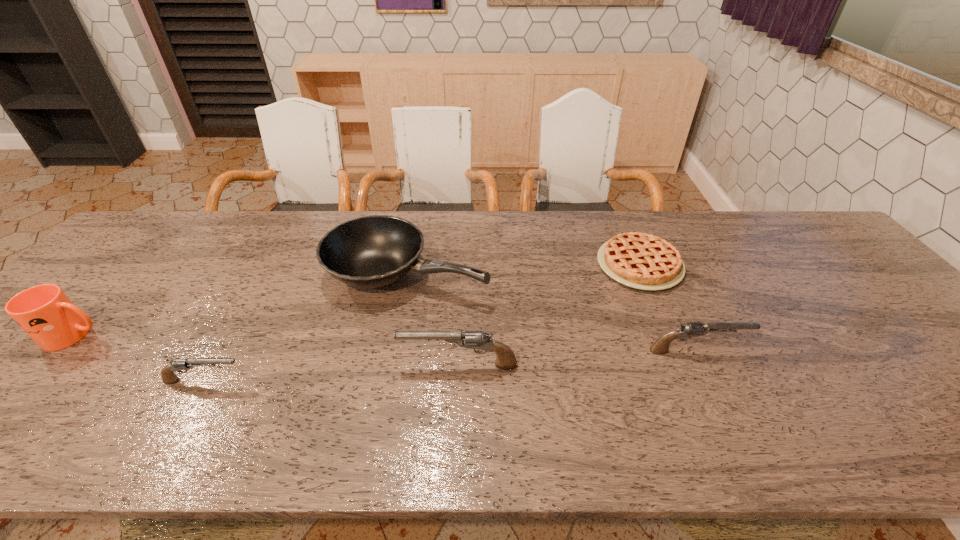
Where is `vacant region located 0.260m aiming along the barrel of the second farthest gun`? vacant region located 0.260m aiming along the barrel of the second farthest gun is located at coordinates (287, 365).

The width and height of the screenshot is (960, 540). I want to click on blank space located aiming along the barrel of the second farthest gun, so tap(265, 365).

Where is `vacant area situated aiming along the barrel of the second farthest gun`? Image resolution: width=960 pixels, height=540 pixels. vacant area situated aiming along the barrel of the second farthest gun is located at coordinates (322, 365).

I want to click on vacant region located aiming along the barrel of the rightmost gun, so click(909, 350).

Find the location of a particular element. The height and width of the screenshot is (540, 960). vacant space located on the left of the pie is located at coordinates (468, 265).

At what (x,y) coordinates should I click in order to perform the action: click on vacant space located 0.190m on the handle side of the leftmost object. Please return your answer as a coordinate pair (x, y). Image resolution: width=960 pixels, height=540 pixels. Looking at the image, I should click on (182, 335).

This screenshot has width=960, height=540. What are the coordinates of `blank space located 0.200m on the right of the frying pan` in the screenshot? It's located at (560, 273).

Image resolution: width=960 pixels, height=540 pixels. Identify the location of pie that is at the far edge. (643, 261).

Locate an element on the screen. This screenshot has height=540, width=960. frying pan that is at the far edge is located at coordinates (368, 252).

Where is `object that is positioned at the near edge`? This screenshot has height=540, width=960. object that is positioned at the near edge is located at coordinates (168, 376).